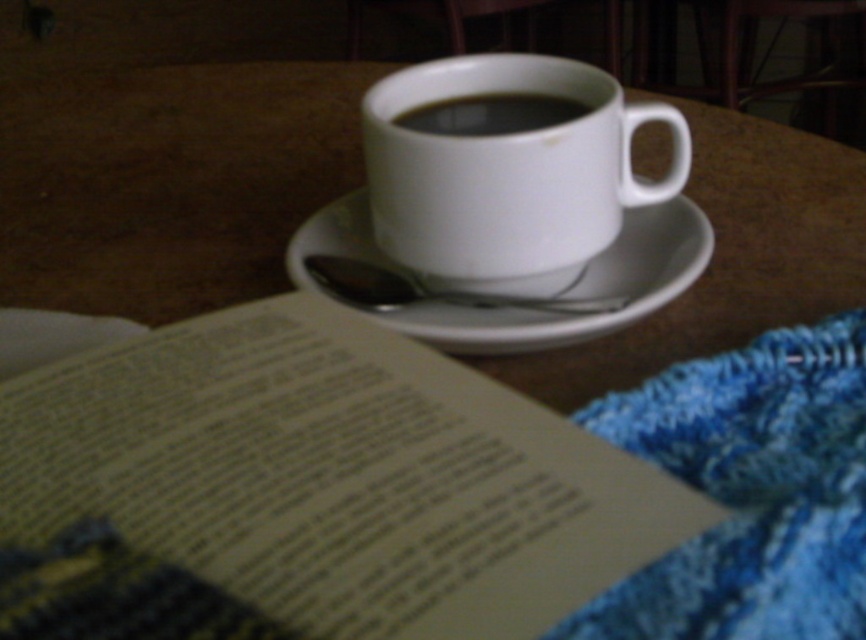
You are a barista who needs to place a new coffee cup on the table without touching the existing items. The paper book at center and the white ceramic mug at upper center are already there. What is the minimum distance you should maintain between the new cup and the existing items?

The paper book at center is 12.90 centimeters from the white ceramic mug at upper center. To avoid touching any existing items, the new cup should be placed at least 12.90 centimeters away from both the paper book at center and the white ceramic mug at upper center.

Based on the photo, you are a photographer trying to capture the paper book at center. If your camera focuses on the cup of coffee behind it, will the book still be in focus?

The paper book at center is located at point (x=307, y=490), so if the camera focuses on the cup of coffee behind it, the book might still be in focus depending on the depth of field. However, since the scene description mentions the book pages are slightly blurred, focusing on the coffee might further blur the book.

You are organizing a shelf and need to know the height of the objects to arrange them properly. Which object is shorter between the paper book at center and the white ceramic mug at upper center?

The paper book at center has a lesser height compared to the white ceramic mug at upper center, so the paper book at center is shorter.